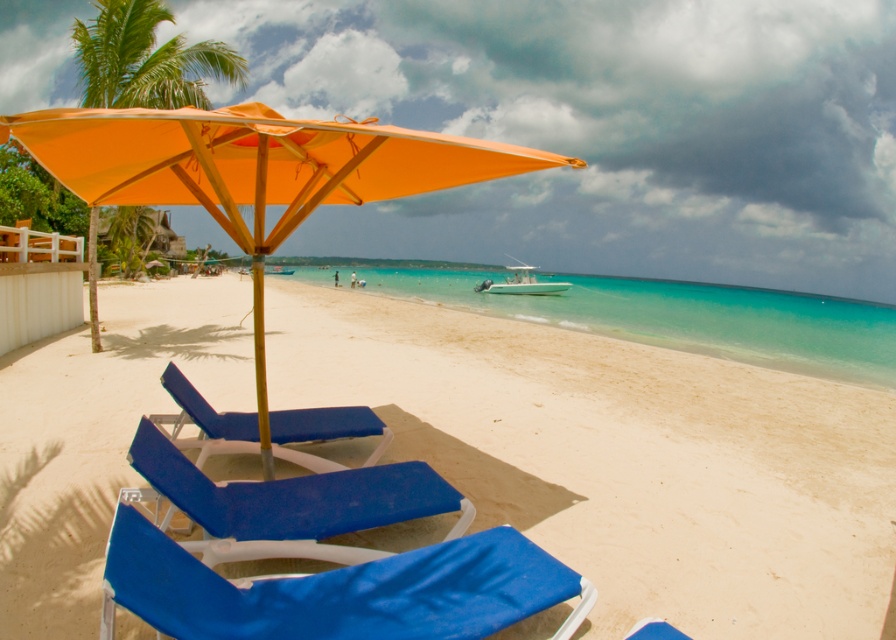
Question: Is blue fabric beach chair at lower left in front of white glossy boat at center?

Choices:
 (A) no
 (B) yes

Answer: (B)

Question: Which point is closer to the camera?

Choices:
 (A) (757, 548)
 (B) (142, 470)
 (C) (199, 76)
 (D) (676, 307)

Answer: (B)

Question: Which object appears farthest from the camera in this image?

Choices:
 (A) blue fabric beach chair at center
 (B) matte blue lounge chair at center
 (C) blue fabric beach chair at lower left

Answer: (A)

Question: Estimate the real-world distances between objects in this image. Which object is farther from the green leafy palm tree at upper left?

Choices:
 (A) white glossy boat at center
 (B) clear blue water at center
 (C) white sand at center

Answer: (A)

Question: Where is orange fabric umbrella at center located in relation to blue fabric beach chair at lower left in the image?

Choices:
 (A) above
 (B) below

Answer: (A)

Question: Can you confirm if orange fabric umbrella at center is positioned below green leafy palm tree at upper left?

Choices:
 (A) no
 (B) yes

Answer: (B)